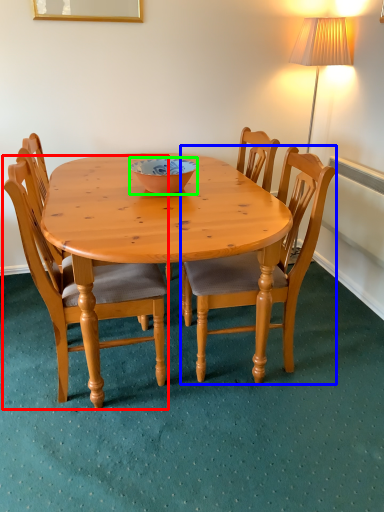
Question: Based on their relative distances, which object is nearer to chair (highlighted by a red box)? Choose from chair (highlighted by a blue box) and bowl (highlighted by a green box).

Choices:
 (A) chair
 (B) bowl

Answer: (A)